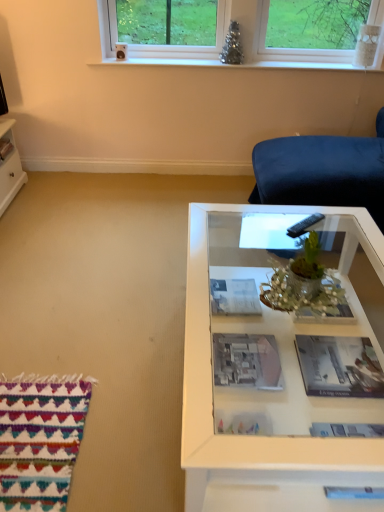
You are a GUI agent. You are given a task and a screenshot of the screen. Output one action in this format:
    pyautogui.click(x=<x>, y=<y>)
    Task: Click on the blank space situated above matte paper magazine at center, placed as the first magazine when sorted from left to right (from a real-world perspective)
    The width and height of the screenshot is (384, 512).
    Given the screenshot: What is the action you would take?
    pyautogui.click(x=230, y=294)